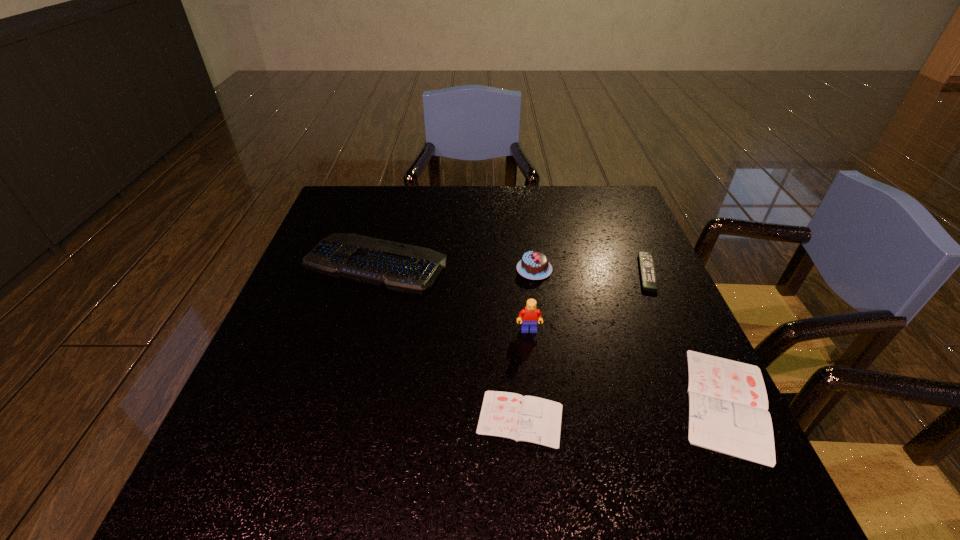
Please point a vacant point for placing a diary on the left. Please provide its 2D coordinates. Your answer should be formatted as a tuple, i.e. [(x, y)], where the tuple contains the x and y coordinates of a point satisfying the conditions above.

[(300, 436)]